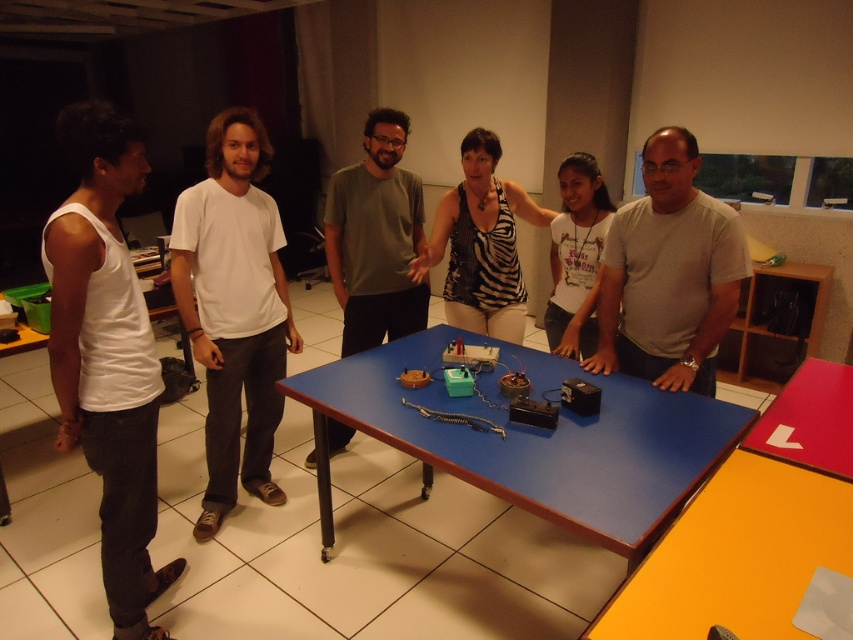
Which is in front, point (131, 524) or point (386, 244)?

Point (131, 524)

Where is `white matte tank top at left`? The image size is (853, 640). white matte tank top at left is located at coordinates (107, 355).

Is point (665, 173) positioned after point (404, 125)?

No, it is in front of (404, 125).

Which is below, white matte shirt at center or gray matte shirt at center?

Positioned lower is white matte shirt at center.

I want to click on white matte shirt at center, so click(669, 273).

Find the location of a particular element. white matte shirt at center is located at coordinates (669, 273).

Is point (80, 380) in front of point (834, 436)?

No.

Which of these two, white matte tank top at left or smooth plastic table at lower right, stands shorter?

smooth plastic table at lower right

The image size is (853, 640). In order to click on white matte tank top at left in this screenshot , I will do `click(107, 355)`.